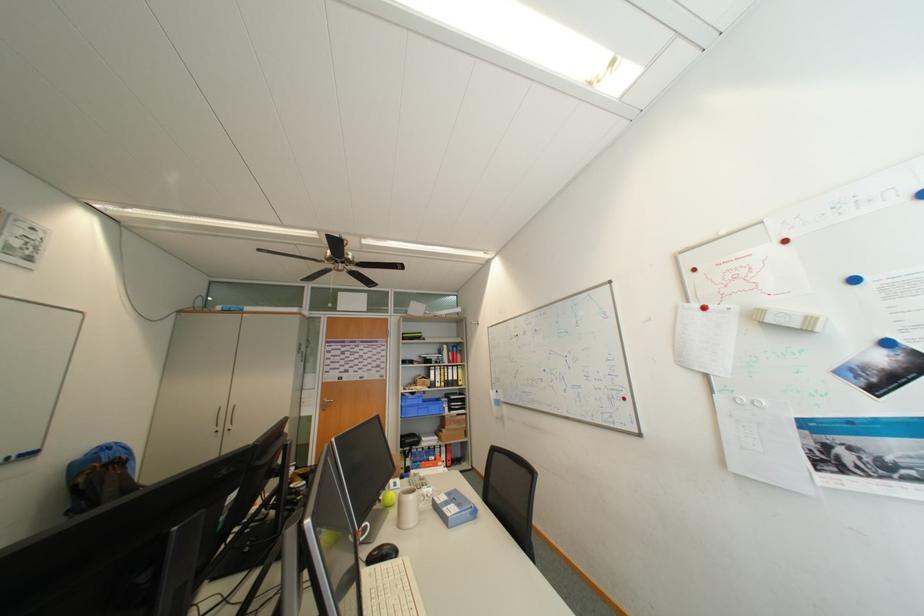
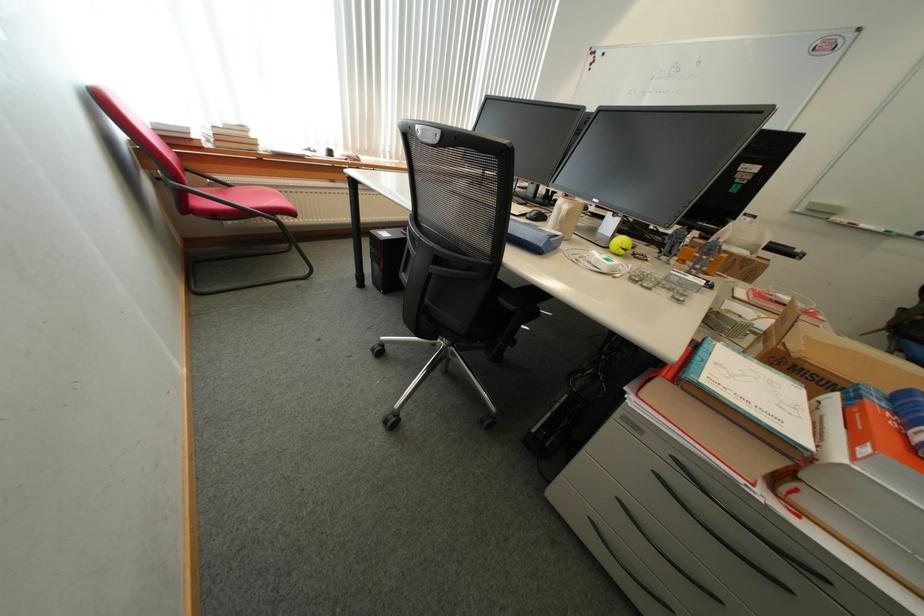
Find the pixel in the second image that matches pixel 446 467 in the first image.

(864, 446)